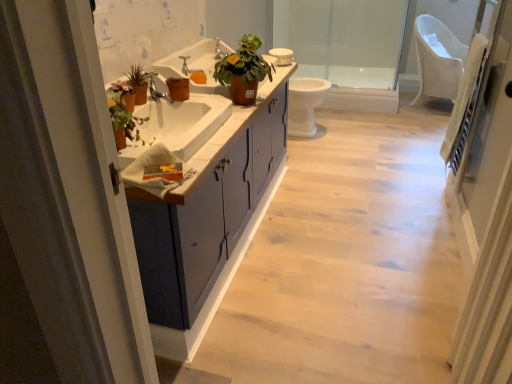
Find the location of a particular element. This screenshot has height=384, width=512. free space between white glossy toilet at center and white textured screen door at right is located at coordinates coord(364,232).